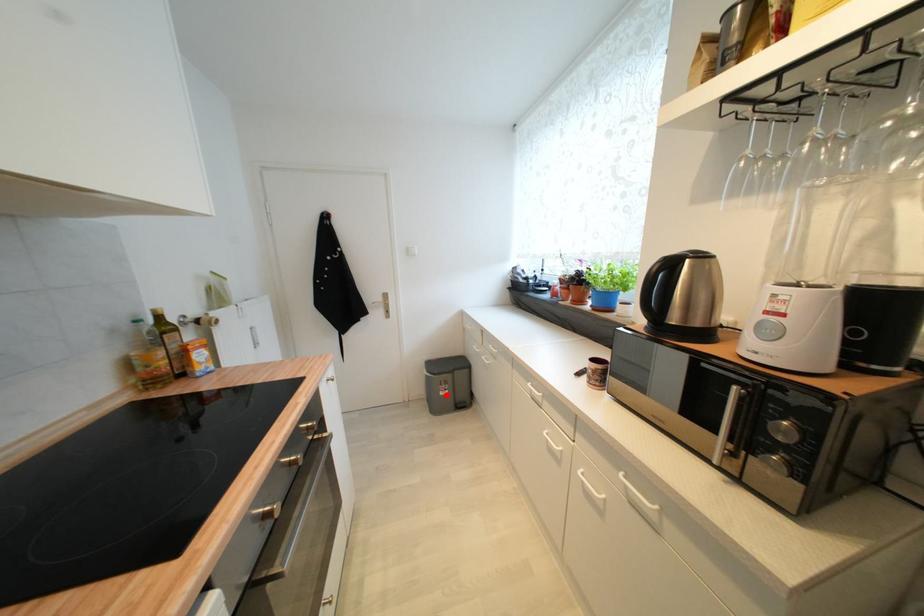
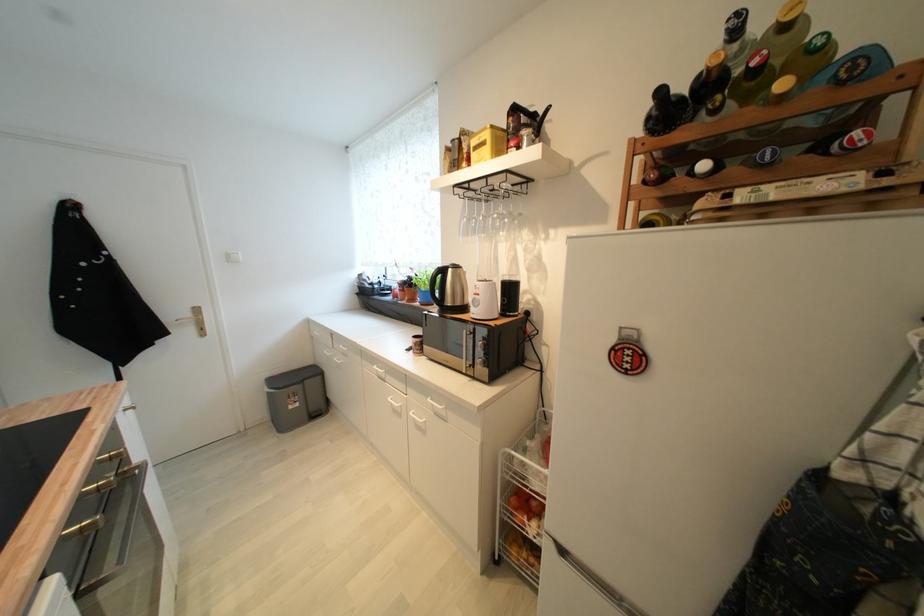
The point at the highlighted location is marked in the first image. Where is the corresponding point in the second image?

(296, 408)